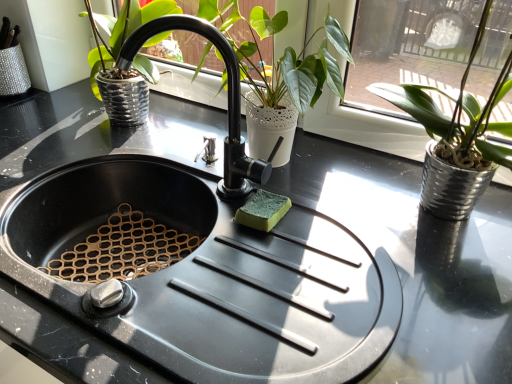
Where is `vacant area that is in front of black matte faucet at center`? The width and height of the screenshot is (512, 384). vacant area that is in front of black matte faucet at center is located at coordinates (205, 282).